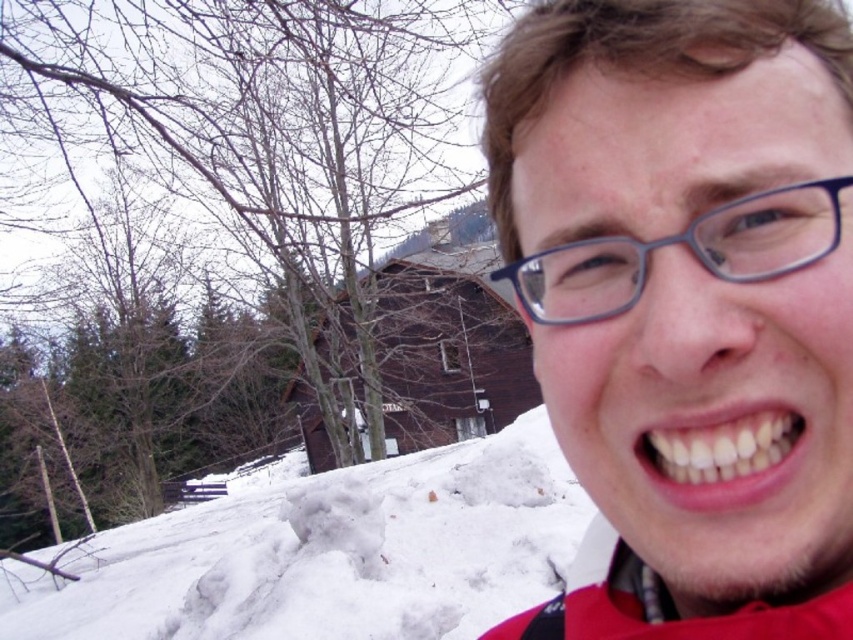
Question: Which point is farther to the camera?

Choices:
 (A) (764, 240)
 (B) (706, 500)
 (C) (480, 557)

Answer: (C)

Question: Which object appears closest to the camera in this image?

Choices:
 (A) blue plastic glasses at upper right
 (B) white glossy teeth at lower right

Answer: (A)

Question: Which object appears farthest from the camera in this image?

Choices:
 (A) blue plastic glasses at upper right
 (B) white glossy teeth at lower right
 (C) white fluffy snow at lower left

Answer: (C)

Question: Does matte blue glasses at center come behind white glossy teeth at lower right?

Choices:
 (A) no
 (B) yes

Answer: (A)

Question: Is matte blue glasses at center behind white glossy teeth at lower right?

Choices:
 (A) yes
 (B) no

Answer: (B)

Question: Can you confirm if matte blue glasses at center is wider than white glossy teeth at lower right?

Choices:
 (A) no
 (B) yes

Answer: (B)